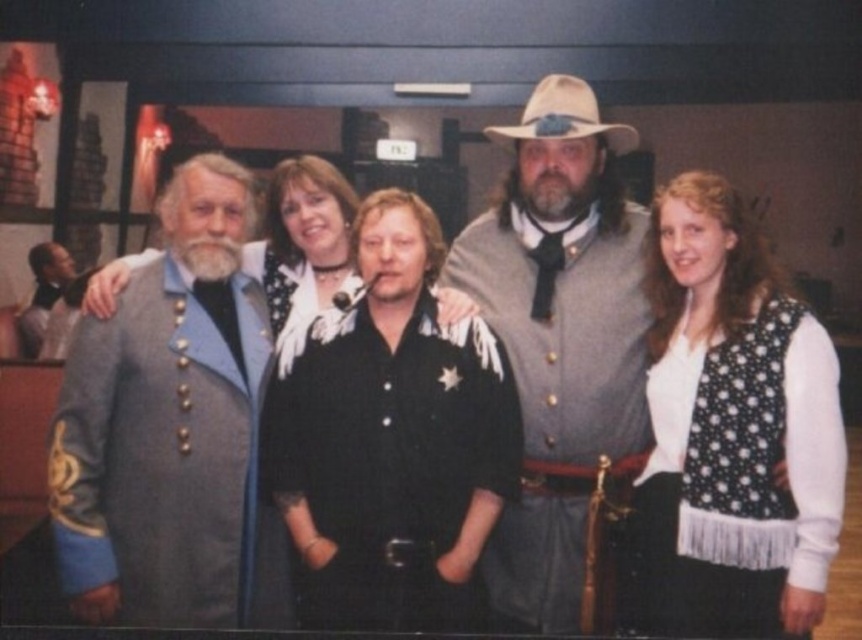
You are standing in the room where the group is posing. You need to locate the gray wool coat at left. Where exactly is it positioned in terms of coordinates?

The gray wool coat at left is positioned at coordinates 0.672 on the x axis and 0.200 on the y axis.